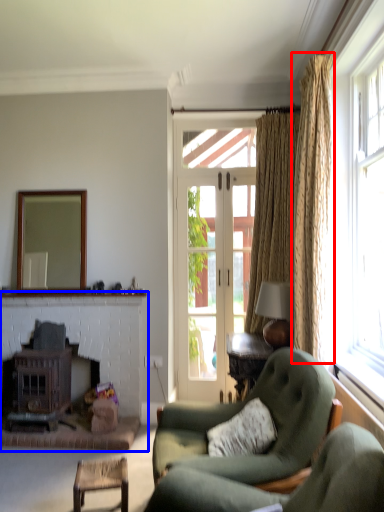
Question: Which object appears farthest to the camera in this image, curtain (highlighted by a red box) or fireplace (highlighted by a blue box)?

Choices:
 (A) curtain
 (B) fireplace

Answer: (B)